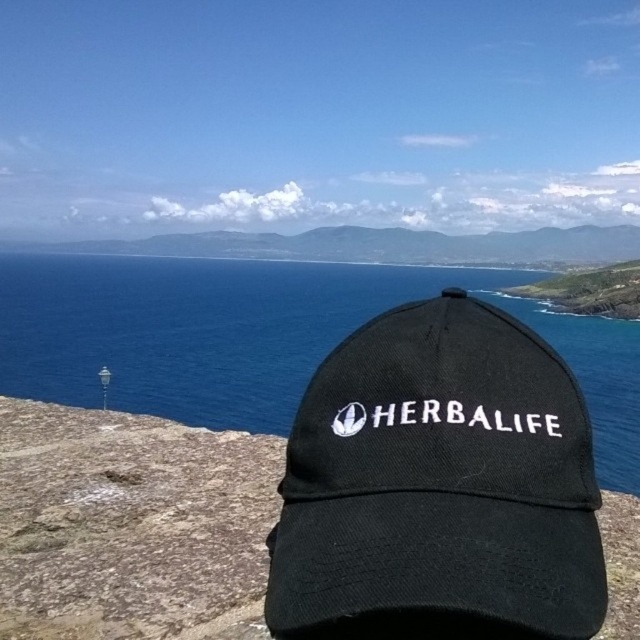
Locate an element on the screen. blue water at center is located at coordinates (262, 337).

This screenshot has width=640, height=640. Describe the element at coordinates (262, 337) in the screenshot. I see `blue water at center` at that location.

Where is `blue water at center`? Image resolution: width=640 pixels, height=640 pixels. blue water at center is located at coordinates (262, 337).

Which is below, black fabric baseball cap at center or blue water at center?

black fabric baseball cap at center is below.

Find the location of a particular element. black fabric baseball cap at center is located at coordinates (438, 486).

Locate an element on the screen. Image resolution: width=640 pixels, height=640 pixels. black fabric baseball cap at center is located at coordinates (438, 486).

Can you confirm if black fabric baseball cap at center is bigger than black fabric cap at center?

No.

Can you confirm if black fabric baseball cap at center is shorter than black fabric cap at center?

No.

Is point (412, 468) more distant than point (29, 500)?

That is False.

The height and width of the screenshot is (640, 640). Find the location of `black fabric baseball cap at center`. black fabric baseball cap at center is located at coordinates (438, 486).